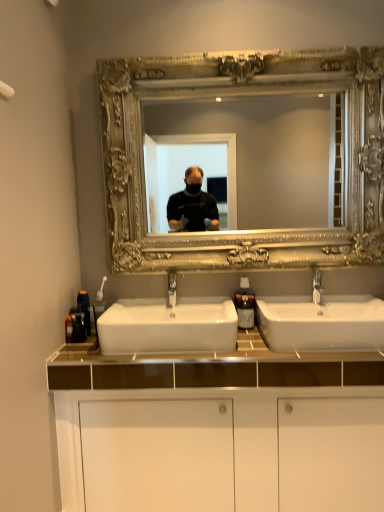
The width and height of the screenshot is (384, 512). Describe the element at coordinates (78, 326) in the screenshot. I see `translucent plastic bottle at left, which is the 1th toiletry in front-to-back order` at that location.

Image resolution: width=384 pixels, height=512 pixels. Identify the location of white glossy sink at center, acting as the 1th sink starting from the left. (168, 324).

What do you see at coordinates (317, 287) in the screenshot?
I see `silver metallic faucet at center` at bounding box center [317, 287].

Identify the location of matte black container at left, placed as the 2th toiletry when sorted from front to back. The width and height of the screenshot is (384, 512). (85, 308).

Is white plastic toothbrush at left, which appears as the first soap dispenser when viewed from the left, to the left of silver metallic faucet at center from the viewer's perspective?

Yes, white plastic toothbrush at left, which appears as the first soap dispenser when viewed from the left, is to the left of silver metallic faucet at center.

Is white plastic toothbrush at left, which is counted as the 2th soap dispenser, starting from the right, smaller than silver metallic faucet at center?

Incorrect, white plastic toothbrush at left, which is counted as the 2th soap dispenser, starting from the right, is not smaller in size than silver metallic faucet at center.

Is white plastic toothbrush at left, which is counted as the 2th soap dispenser, starting from the right, in front of or behind silver metallic faucet at center in the image?

white plastic toothbrush at left, which is counted as the 2th soap dispenser, starting from the right, is behind silver metallic faucet at center.

You are a GUI agent. You are given a task and a screenshot of the screen. Output one action in this format:
    pyautogui.click(x=<x>, y=<y>)
    Task: Click on the toiletry in front of the silver ornate mirror at upper center
    
    Given the screenshot: What is the action you would take?
    pyautogui.click(x=78, y=326)

Considering the sizes of objects silver ornate mirror at upper center and translucent plastic bottle at left, the second toiletry in the back-to-front sequence, in the image provided, who is wider, silver ornate mirror at upper center or translucent plastic bottle at left, the second toiletry in the back-to-front sequence,?

silver ornate mirror at upper center.

From the image's perspective, relative to translucent plastic bottle at left, which is the 1th toiletry in front-to-back order, is silver ornate mirror at upper center above or below?

Based on their image positions, silver ornate mirror at upper center is located above translucent plastic bottle at left, which is the 1th toiletry in front-to-back order.

From the picture: From a real-world perspective, is translucent plastic soap dispenser at center, arranged as the 2th soap dispenser when viewed from the left, physically located above or below silver ornate mirror at upper center?

From a real-world perspective, translucent plastic soap dispenser at center, arranged as the 2th soap dispenser when viewed from the left, is physically below silver ornate mirror at upper center.

Does translucent plastic soap dispenser at center, which is counted as the 1th soap dispenser, starting from the right, have a lesser height compared to silver ornate mirror at upper center?

Correct, translucent plastic soap dispenser at center, which is counted as the 1th soap dispenser, starting from the right, is not as tall as silver ornate mirror at upper center.

From the image's perspective, between translucent plastic soap dispenser at center, which is counted as the 1th soap dispenser, starting from the right, and silver ornate mirror at upper center, who is located below?

translucent plastic soap dispenser at center, which is counted as the 1th soap dispenser, starting from the right, is shown below in the image.

Considering the relative positions of translucent plastic soap dispenser at center, which is counted as the 1th soap dispenser, starting from the right, and silver ornate mirror at upper center in the image provided, is translucent plastic soap dispenser at center, which is counted as the 1th soap dispenser, starting from the right, in front of silver ornate mirror at upper center?

No, translucent plastic soap dispenser at center, which is counted as the 1th soap dispenser, starting from the right, is further to the viewer.

From a real-world perspective, is white glossy cabinet at center positioned above or below translucent plastic soap dispenser at center, arranged as the 2th soap dispenser when viewed from the left?

From a real-world perspective, white glossy cabinet at center is physically below translucent plastic soap dispenser at center, arranged as the 2th soap dispenser when viewed from the left.

Is white glossy cabinet at center located outside translucent plastic soap dispenser at center, arranged as the 2th soap dispenser when viewed from the left?

Yes, white glossy cabinet at center is located beyond the bounds of translucent plastic soap dispenser at center, arranged as the 2th soap dispenser when viewed from the left.

Where is `bathroom cabinet in front of the translucent plastic soap dispenser at center, which is counted as the 1th soap dispenser, starting from the right`? The height and width of the screenshot is (512, 384). bathroom cabinet in front of the translucent plastic soap dispenser at center, which is counted as the 1th soap dispenser, starting from the right is located at coordinates (218, 420).

In the scene shown: Is white glossy sink at center, marked as the second sink in a right-to-left arrangement, next to translucent plastic bottle at left, which is the 1th toiletry in front-to-back order, and touching it?

No.

Based on the photo, is translucent plastic bottle at left, the second toiletry in the back-to-front sequence, at the back of white glossy sink at center, marked as the second sink in a right-to-left arrangement?

No, white glossy sink at center, marked as the second sink in a right-to-left arrangement, is not facing away from translucent plastic bottle at left, the second toiletry in the back-to-front sequence.

Which is behind, point (200, 314) or point (75, 326)?

Positioned behind is point (200, 314).

Considering the sizes of objects white glossy sink at center, acting as the 1th sink starting from the left, and translucent plastic bottle at left, the second toiletry in the back-to-front sequence, in the image provided, who is shorter, white glossy sink at center, acting as the 1th sink starting from the left, or translucent plastic bottle at left, the second toiletry in the back-to-front sequence,?

With less height is translucent plastic bottle at left, the second toiletry in the back-to-front sequence.

From the image's perspective, does silver ornate mirror at upper center appear higher than white plastic toothbrush at left, which appears as the first soap dispenser when viewed from the left?

Yes, from the image's perspective, silver ornate mirror at upper center is on top of white plastic toothbrush at left, which appears as the first soap dispenser when viewed from the left.

Considering the sizes of objects silver ornate mirror at upper center and white plastic toothbrush at left, which appears as the first soap dispenser when viewed from the left, in the image provided, who is shorter, silver ornate mirror at upper center or white plastic toothbrush at left, which appears as the first soap dispenser when viewed from the left,?

white plastic toothbrush at left, which appears as the first soap dispenser when viewed from the left.

Is the depth of silver ornate mirror at upper center greater than that of white plastic toothbrush at left, which appears as the first soap dispenser when viewed from the left?

No.

How many degrees apart are the facing directions of white glossy cabinet at center and silver metallic faucet at center?

The angle between the facing direction of white glossy cabinet at center and the facing direction of silver metallic faucet at center is 0.801 degrees.

Which is closer, (x=358, y=416) or (x=321, y=286)?

Clearly, point (x=358, y=416) is closer to the camera than point (x=321, y=286).

Is white glossy cabinet at center looking in the opposite direction of silver metallic faucet at center?

No, silver metallic faucet at center is not at the back of white glossy cabinet at center.

You are a GUI agent. You are given a task and a screenshot of the screen. Output one action in this format:
    pyautogui.click(x=<x>, y=<y>)
    Task: Click on the tap above the white plastic toothbrush at left, which appears as the first soap dispenser when viewed from the left (from a real-world perspective)
    
    Given the screenshot: What is the action you would take?
    pyautogui.click(x=317, y=287)

Where is `toiletry lying in front of the silver ornate mirror at upper center`? The height and width of the screenshot is (512, 384). toiletry lying in front of the silver ornate mirror at upper center is located at coordinates (78, 326).

Considering their positions, is white glossy sink at center, marked as the second sink in a right-to-left arrangement, positioned further to translucent plastic bottle at left, the second toiletry in the back-to-front sequence, than translucent plastic soap dispenser at center, which is counted as the 1th soap dispenser, starting from the right?

translucent plastic soap dispenser at center, which is counted as the 1th soap dispenser, starting from the right, is positioned further to the anchor translucent plastic bottle at left, the second toiletry in the back-to-front sequence.

Based on their spatial positions, is silver metallic faucet at center or white glossy sink at center, marked as the second sink in a right-to-left arrangement, further from white glossy cabinet at center?

silver metallic faucet at center is positioned further to the anchor white glossy cabinet at center.

Based on their spatial positions, is silver ornate mirror at upper center or matte black container at left, placed as the 2th toiletry when sorted from front to back, closer to translucent plastic bottle at left, which is the 1th toiletry in front-to-back order?

matte black container at left, placed as the 2th toiletry when sorted from front to back, is positioned closer to the anchor translucent plastic bottle at left, which is the 1th toiletry in front-to-back order.

From the image, which object appears to be farther from matte black container at left, marked as the first toiletry in a back-to-front arrangement, silver ornate mirror at upper center or translucent plastic soap dispenser at center, arranged as the 2th soap dispenser when viewed from the left?

Based on the image, silver ornate mirror at upper center appears to be further to matte black container at left, marked as the first toiletry in a back-to-front arrangement.

Considering their positions, is white glossy sink at center, acting as the 1th sink starting from the left, positioned closer to white glossy cabinet at center than silver metallic faucet at center?

white glossy sink at center, acting as the 1th sink starting from the left, is closer to white glossy cabinet at center.

Looking at the image, which one is located further to white glossy sink at center, arranged as the second sink when viewed from the left, white plastic toothbrush at left, which is counted as the 2th soap dispenser, starting from the right, or matte black container at left, marked as the first toiletry in a back-to-front arrangement?

matte black container at left, marked as the first toiletry in a back-to-front arrangement, lies further to white glossy sink at center, arranged as the second sink when viewed from the left, than the other object.

Which object lies further to the anchor point translucent plastic soap dispenser at center, arranged as the 2th soap dispenser when viewed from the left, matte black container at left, placed as the 2th toiletry when sorted from front to back, or white glossy sink at center, the first sink when ordered from right to left?

Among the two, matte black container at left, placed as the 2th toiletry when sorted from front to back, is located further to translucent plastic soap dispenser at center, arranged as the 2th soap dispenser when viewed from the left.

From the image, which object appears to be farther from translucent plastic soap dispenser at center, arranged as the 2th soap dispenser when viewed from the left, translucent plastic bottle at left, the second toiletry in the back-to-front sequence, or silver ornate mirror at upper center?

Based on the image, translucent plastic bottle at left, the second toiletry in the back-to-front sequence, appears to be further to translucent plastic soap dispenser at center, arranged as the 2th soap dispenser when viewed from the left.

In order to click on sink situated between matte black container at left, placed as the 2th toiletry when sorted from front to back, and translucent plastic soap dispenser at center, arranged as the 2th soap dispenser when viewed from the left, from left to right in this screenshot , I will do `click(168, 324)`.

Locate an element on the screen. The image size is (384, 512). soap dispenser between translucent plastic bottle at left, the second toiletry in the back-to-front sequence, and translucent plastic soap dispenser at center, which is counted as the 1th soap dispenser, starting from the right is located at coordinates (99, 304).

Image resolution: width=384 pixels, height=512 pixels. I want to click on bathroom cabinet between white glossy sink at center, acting as the 1th sink starting from the left, and silver metallic faucet at center, so click(218, 420).

This screenshot has width=384, height=512. I want to click on soap dispenser located between white glossy sink at center, marked as the second sink in a right-to-left arrangement, and silver metallic faucet at center in the left-right direction, so click(245, 305).